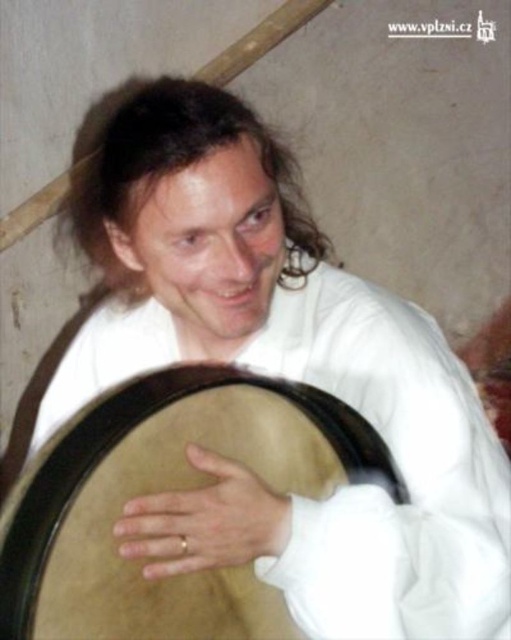
Question: Where is light brown leather drum at lower center located in relation to gold ring at center in the image?

Choices:
 (A) right
 (B) left

Answer: (B)

Question: Which of the following is the farthest from the observer?

Choices:
 (A) [x=204, y=492]
 (B) [x=200, y=577]

Answer: (B)

Question: Can you confirm if light brown leather drum at lower center is positioned below gold ring at center?

Choices:
 (A) yes
 (B) no

Answer: (B)

Question: Is light brown leather drum at lower center bigger than gold ring at center?

Choices:
 (A) yes
 (B) no

Answer: (A)

Question: Which point is closer to the camera taking this photo?

Choices:
 (A) (228, 378)
 (B) (213, 465)

Answer: (B)